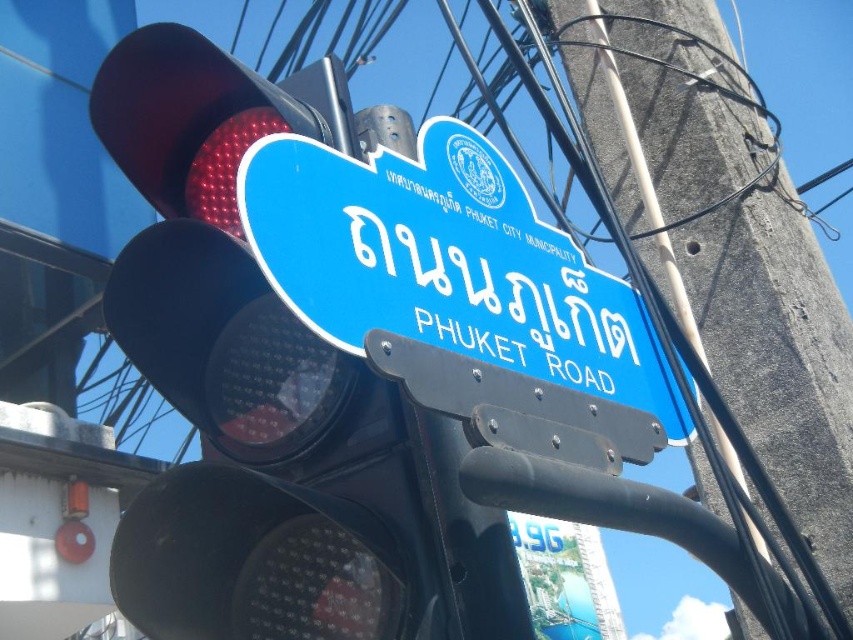
You are a delivery drone flying over Phuket Road. You need to navigate between the metallic traffic light at upper left and the blue street sign mounted on the same pole. Based on their positions, which object is closer to the center of the image?

The metallic traffic light at upper left is located at point (270, 401), so the blue street sign is closer to the center of the image since it shares the same pole but isn

You are a delivery driver who needs to attach a new street sign to the pole. The existing blue plastic street sign at upper center is already mounted on the gray concrete telegraph pole at upper center. Where should you place the new sign so it doesn not block the existing one?

The gray concrete telegraph pole at upper center is to the right of blue plastic street sign at upper center, so you should place the new sign to the left of the existing blue plastic street sign at upper center to avoid blocking it.

You are a pedestrian standing at the intersection and want to know which object is higher up in the image. Which one is positioned higher between the metallic traffic light at upper left and the blue plastic street sign at upper center?

The blue plastic street sign at upper center is positioned higher than the metallic traffic light at upper left.